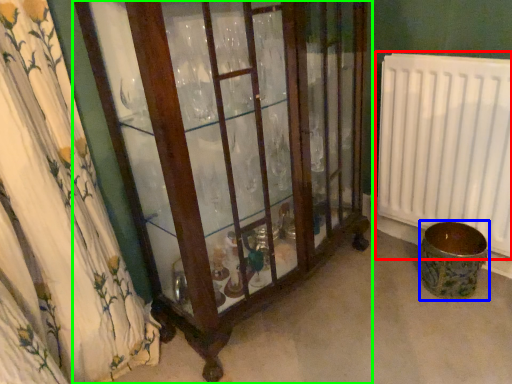
Question: Considering the real-world distances, which object is farthest from radiator (highlighted by a red box)? toilet bowl (highlighted by a blue box) or furniture (highlighted by a green box)?

Choices:
 (A) toilet bowl
 (B) furniture

Answer: (B)